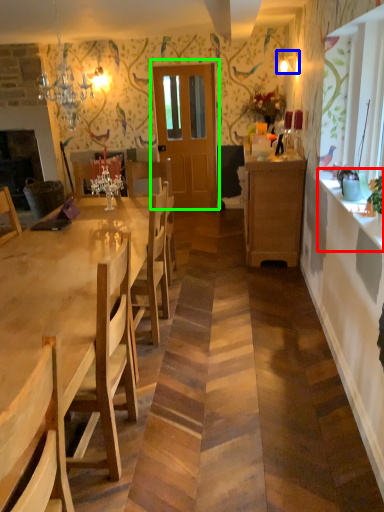
Question: Considering the real-world distances, which object is closest to counter top (highlighted by a red box)? lamp (highlighted by a blue box) or door (highlighted by a green box).

Choices:
 (A) lamp
 (B) door

Answer: (A)